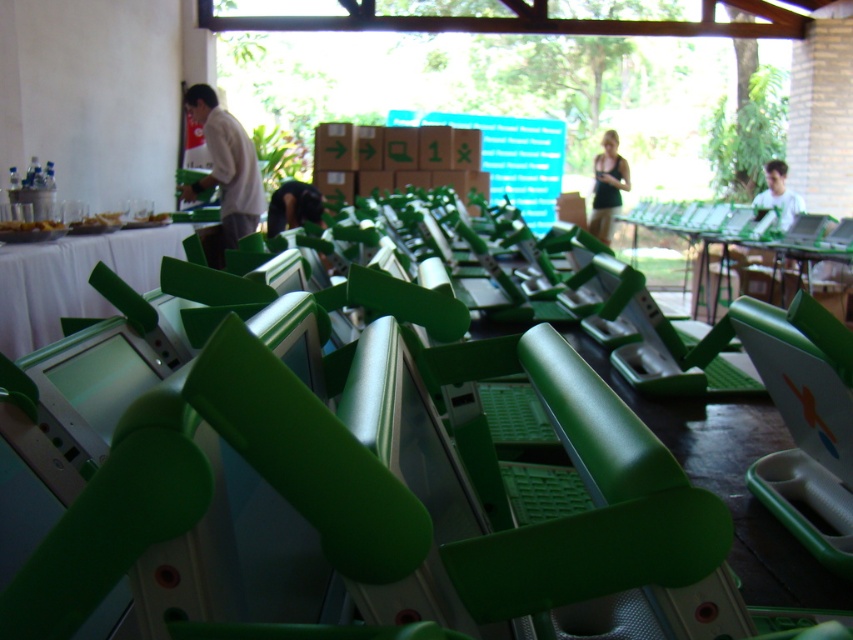
Based on the photo, you are standing at the distribution event and want to pick up an item located at point A and then move to point B. If point A is point [598,212] and point B is point [776,189], will you have to move forward or backward after picking up the item at point A to reach point B?

Since point A is further to the camera than point B, you will have to move backward after picking up the item at point A to reach point B.

You are a photographer who needs to set up a camera to capture a closeup of the green plastic folding chair at center. The camera requires a minimum distance of 40 centimeters to focus properly. Based on the scene description, will the camera be able to focus on the chair?

The camera and green plastic folding chair at center are 38.11 centimeters apart. Since the required minimum distance is 40 centimeters, the camera cannot focus properly on the green plastic folding chair at center.

You are standing at the distribution event looking at the laptops arranged on the tables. There are two points marked in the scene, one at coordinates point (314, 522) and another at point (776, 208). Which of these two points is closer to you?

Point (314, 522) is closer to the camera than point (776, 208), so the point at coordinates point (314, 522) is closer to you.